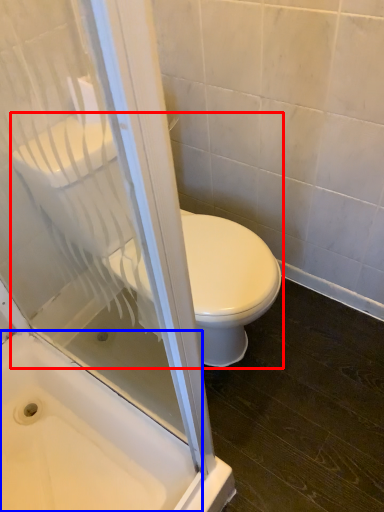
Question: Among these objects, which one is nearest to the camera, toilet (highlighted by a red box) or bath (highlighted by a blue box)?

Choices:
 (A) toilet
 (B) bath

Answer: (A)